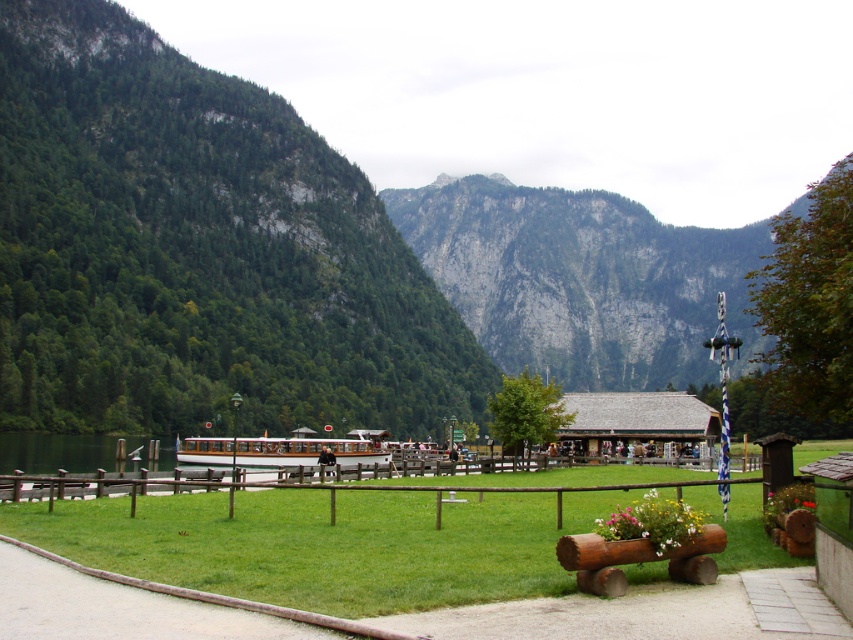
You are standing at the wooden fence in the foreground of the mountain scene. You notice two points marked in the image. Which point, point (390, 458) or point (47, 465), is closer to you?

Point (390, 458) is closer to the viewer than point (47, 465).